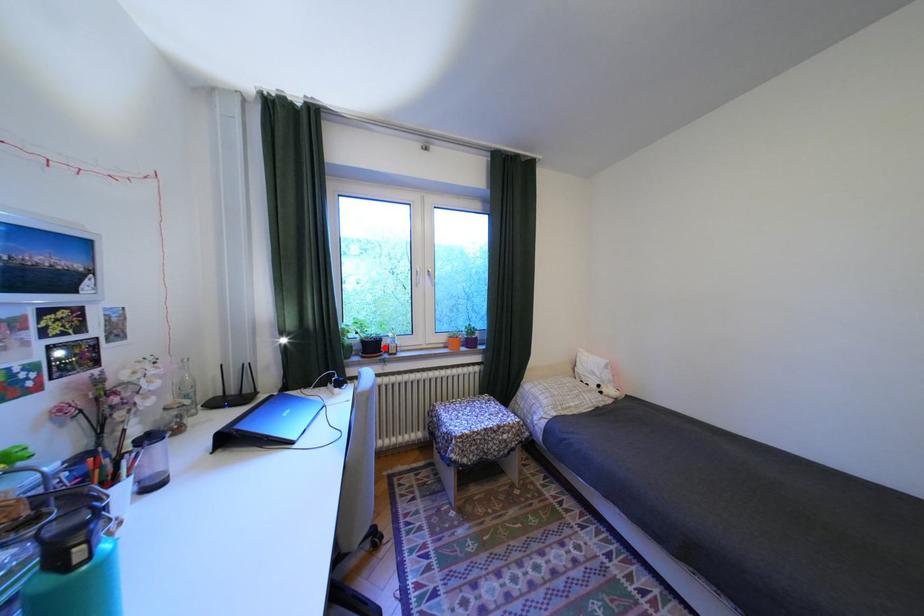
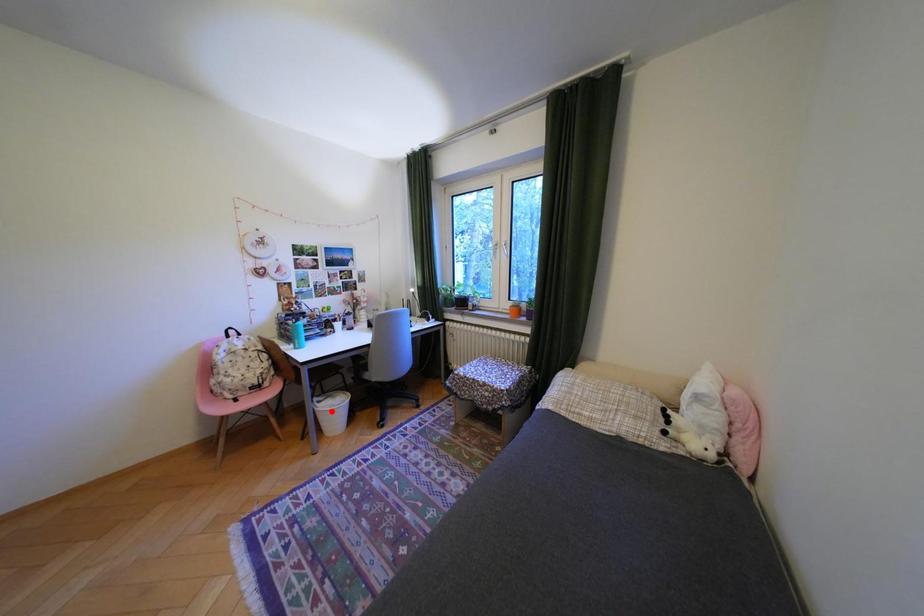
I am providing you with two images of the same scene from different viewpoints. A red point is marked on the first image and another point is marked on the second image. Do the highlighted points in image1 and image2 indicate the same real-world spot?

No